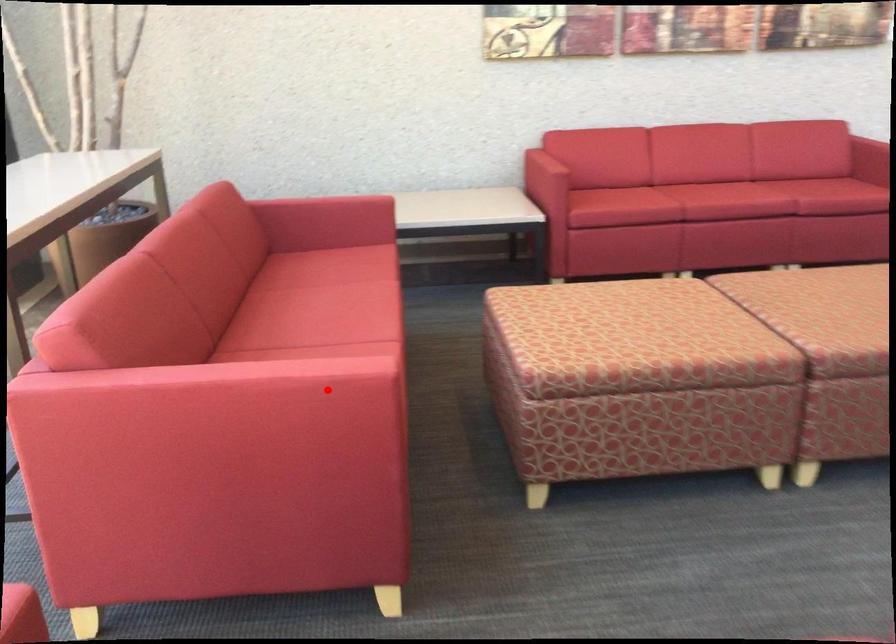
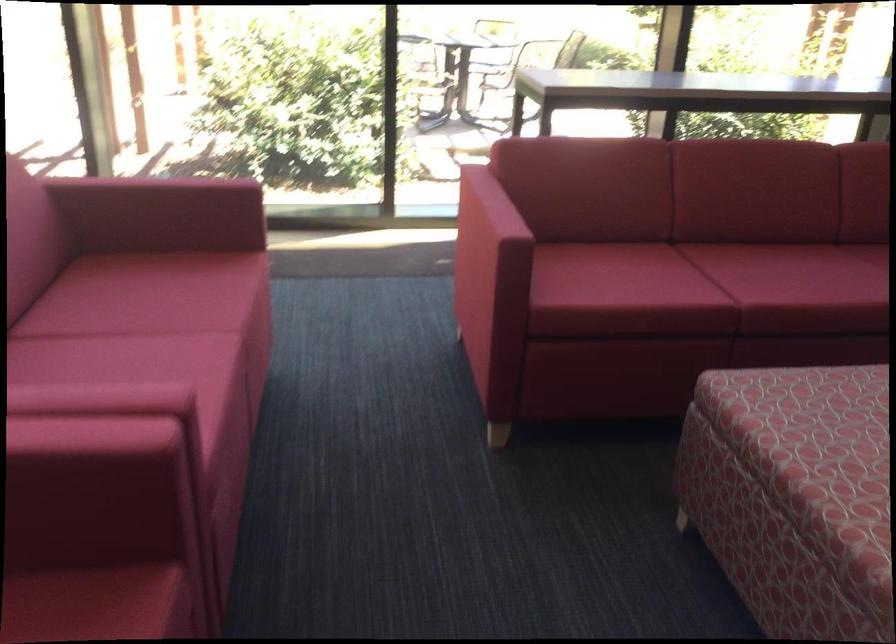
Question: I am providing you with two images of the same scene from different viewpoints. Given a red point in image1, look at the same physical point in image2. Is it:

Choices:
 (A) Closer to the viewpoint
 (B) Farther from the viewpoint

Answer: (B)